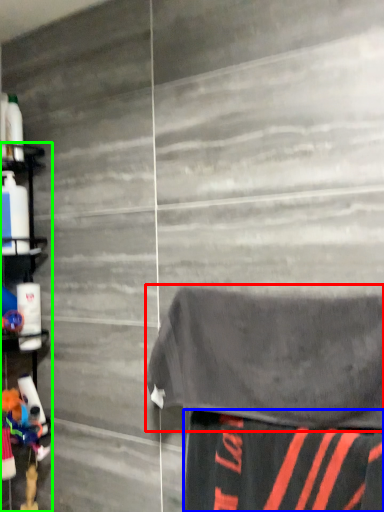
Question: Considering the real-world distances, which object is farthest from bath towel (highlighted by a red box)? fabric (highlighted by a blue box) or shelf (highlighted by a green box)?

Choices:
 (A) fabric
 (B) shelf

Answer: (B)